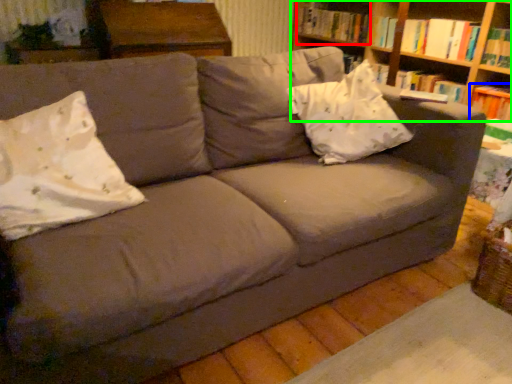
Question: Based on their relative distances, which object is farther from book (highlighted by a red box)? Choose from paperback book (highlighted by a blue box) and shelf (highlighted by a green box).

Choices:
 (A) paperback book
 (B) shelf

Answer: (A)